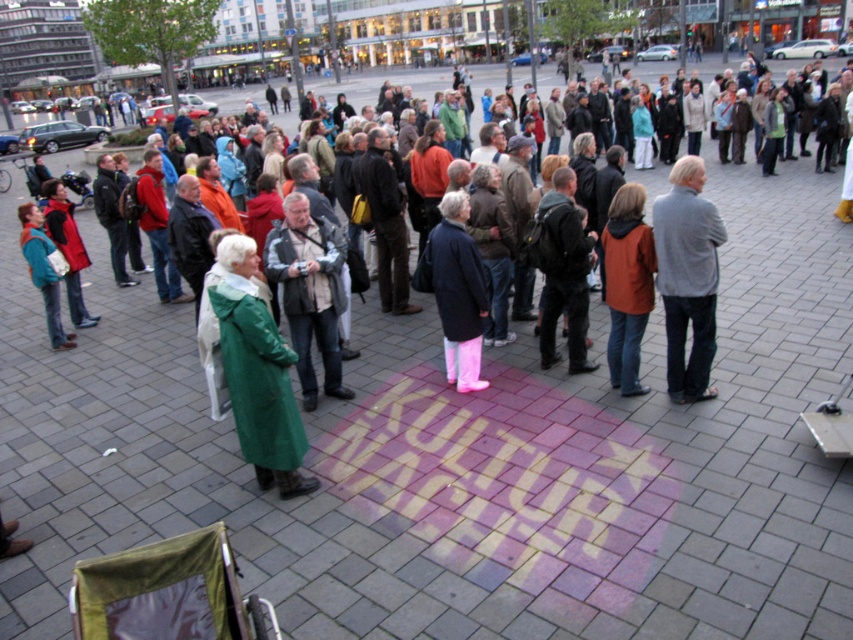
Question: Estimate the real-world distances between objects in this image. Which object is farther from the green matte coat at center?

Choices:
 (A) matte orange jacket at center
 (B) gray wool sweater at right
 (C) dark gray backpack at center

Answer: (B)

Question: In this image, where is green matte coat at center located relative to dark gray backpack at center?

Choices:
 (A) below
 (B) above

Answer: (A)

Question: Does matte orange jacket at center appear over dark gray backpack at center?

Choices:
 (A) no
 (B) yes

Answer: (A)

Question: Does matte orange jacket at center have a larger size compared to dark gray backpack at center?

Choices:
 (A) no
 (B) yes

Answer: (A)

Question: Among these objects, which one is farthest from the camera?

Choices:
 (A) gray wool sweater at right
 (B) matte orange jacket at center
 (C) matte black jacket at center

Answer: (C)

Question: Which object appears closest to the camera in this image?

Choices:
 (A) matte orange jacket at center
 (B) matte black jacket at center
 (C) green fabric coat at center

Answer: (A)